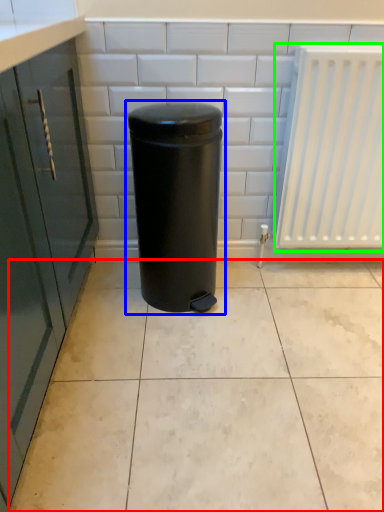
Question: Considering the real-world distances, which object is farthest from ceramic tile (highlighted by a red box)? waste container (highlighted by a blue box) or radiator (highlighted by a green box)?

Choices:
 (A) waste container
 (B) radiator

Answer: (B)